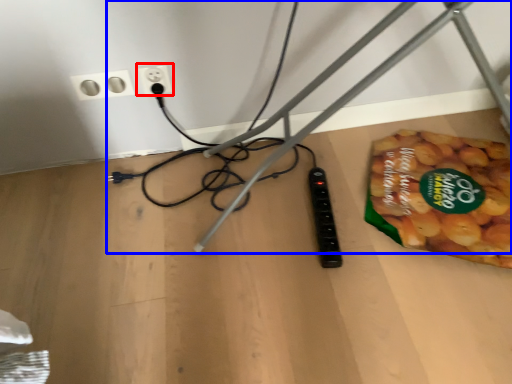
Question: Which object is further to the camera taking this photo, power plugs and sockets (highlighted by a red box) or wire (highlighted by a blue box)?

Choices:
 (A) power plugs and sockets
 (B) wire

Answer: (A)